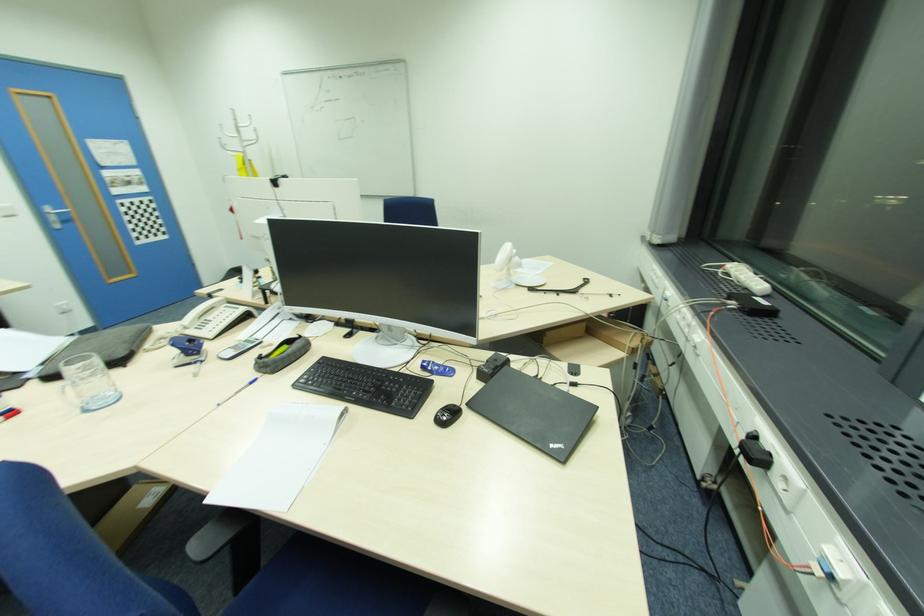
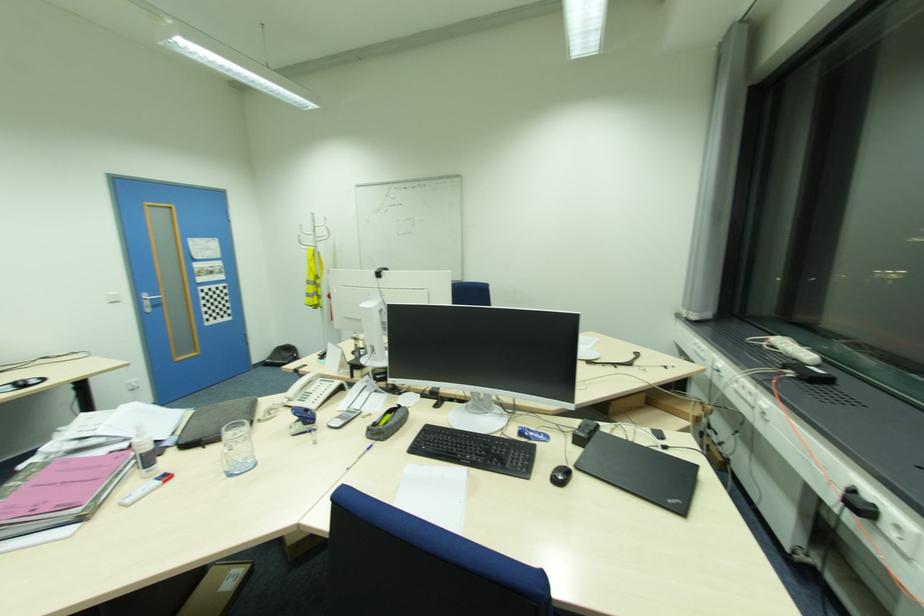
Question: The first image is from the beginning of the video and the second image is from the end. How did the camera likely rotate when shooting the video?

Choices:
 (A) Left
 (B) Right
 (C) Up
 (D) Down

Answer: (C)